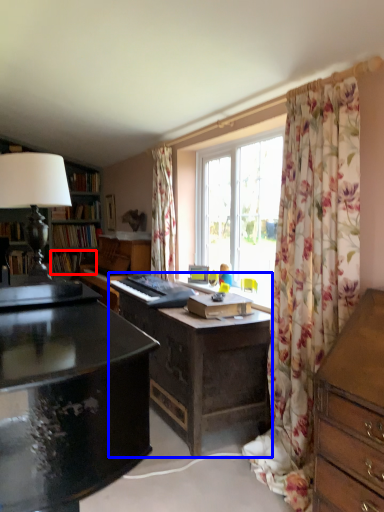
Question: Which object appears farthest to the camera in this image, book (highlighted by a red box) or desk (highlighted by a blue box)?

Choices:
 (A) book
 (B) desk

Answer: (A)